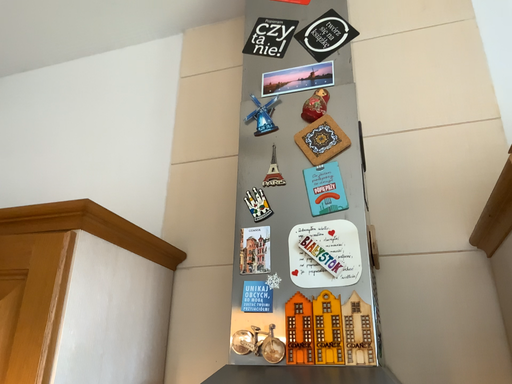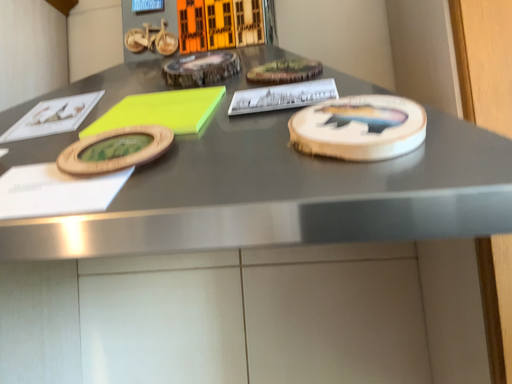
Question: Which way did the camera rotate in the video?

Choices:
 (A) rotated downward
 (B) rotated upward

Answer: (A)